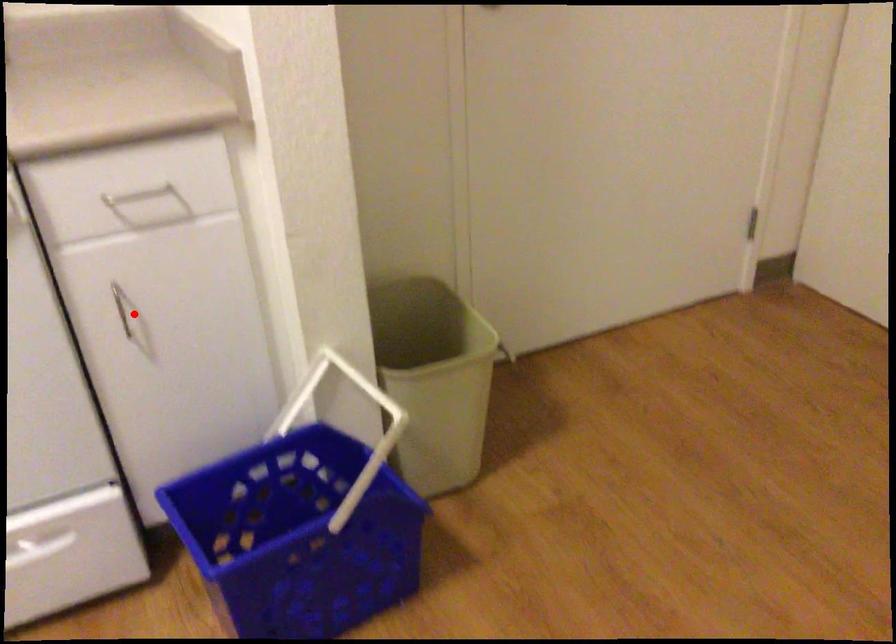
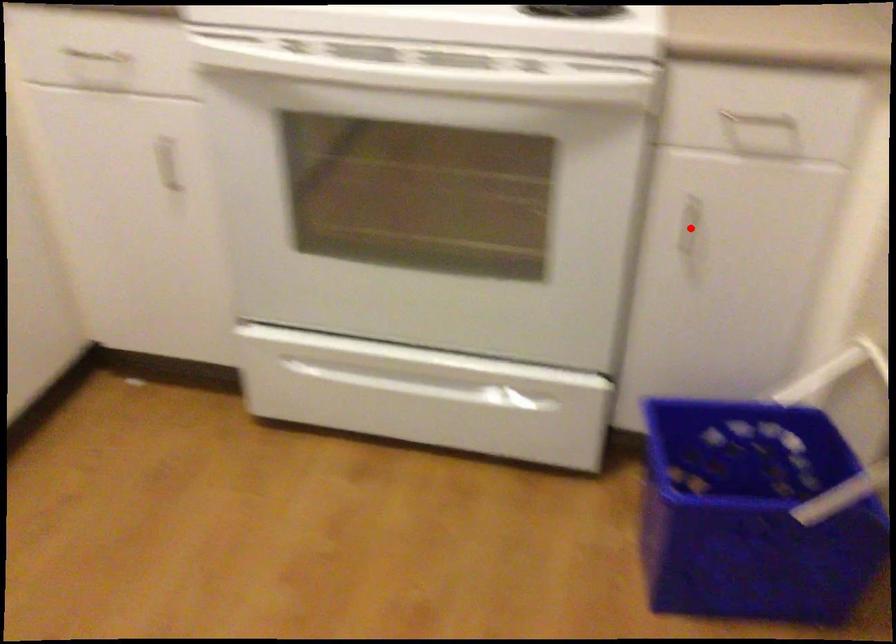
Based on the photo, I am providing you with two images of the same scene from different viewpoints. A red point is marked on the first image and another point is marked on the second image. Are the points marked in image1 and image2 representing the same 3D position?

Yes